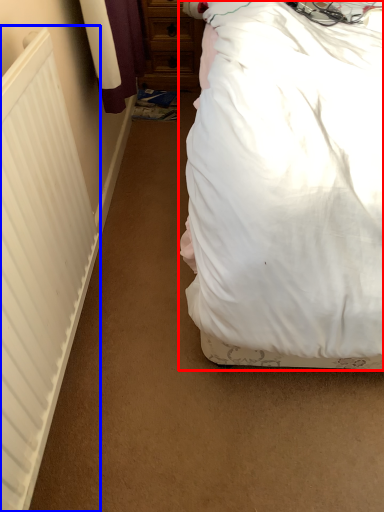
Question: Which of the following is the closest to the observer, bed (highlighted by a red box) or radiator (highlighted by a blue box)?

Choices:
 (A) bed
 (B) radiator

Answer: (A)